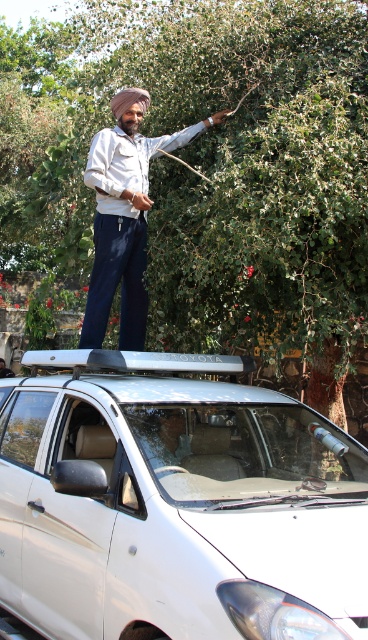
Question: Which point is closer to the camera?

Choices:
 (A) matte white shirt at center
 (B) white matte car at upper center

Answer: (B)

Question: Based on their relative distances, which object is farther from the matte white shirt at center?

Choices:
 (A) white matte car at upper center
 (B) green leafy tree at upper center

Answer: (B)

Question: Can you confirm if white matte car at upper center is thinner than matte white shirt at center?

Choices:
 (A) yes
 (B) no

Answer: (B)

Question: Is white matte car at upper center smaller than matte white shirt at center?

Choices:
 (A) yes
 (B) no

Answer: (B)

Question: Does green leafy tree at upper center have a greater width compared to white matte car at upper center?

Choices:
 (A) no
 (B) yes

Answer: (B)

Question: Among these points, which one is farthest from the camera?

Choices:
 (A) (253, 570)
 (B) (30, 212)

Answer: (B)